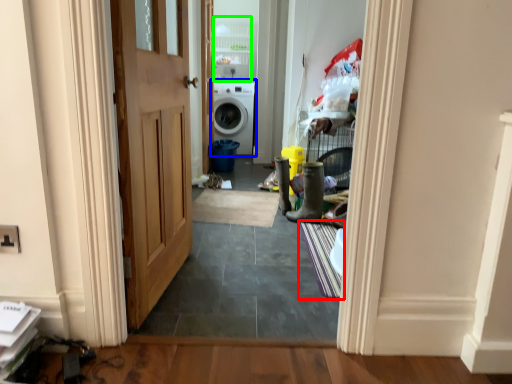
Question: Considering the real-world distances, which object is farthest from doormat (highlighted by a red box)? washing machine (highlighted by a blue box) or cabinetry (highlighted by a green box)?

Choices:
 (A) washing machine
 (B) cabinetry

Answer: (B)